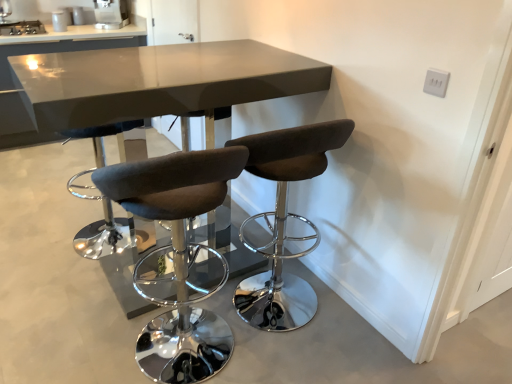
Question: From the image's perspective, is satin silver coffee machine at upper center, which is the 2th appliance in bottom-to-top order, above or below stainless steel stove at upper left, acting as the 2th appliance starting from the top?

Choices:
 (A) below
 (B) above

Answer: (B)

Question: From a real-world perspective, is satin silver coffee machine at upper center, placed as the second appliance when sorted from left to right, physically located above or below stainless steel stove at upper left, the 2th appliance when ordered from right to left?

Choices:
 (A) below
 (B) above

Answer: (B)

Question: Which object is positioned farthest from the stainless steel stove at upper left, the 1th appliance in the bottom-to-top sequence?

Choices:
 (A) brown fabric stool at center, marked as the 1th chair in a right-to-left arrangement
 (B) dark gray fabric stool at center, arranged as the 1th chair when viewed from the left
 (C) satin silver coffee machine at upper center, arranged as the 1th appliance when viewed from the right
 (D) glossy gray table at upper center, which is the 1th table from left to right
 (E) matte gray table at center, the 2th table viewed from the left

Answer: (A)

Question: Considering the real-world distances, which object is closest to the dark gray fabric stool at center, arranged as the 1th chair when viewed from the left?

Choices:
 (A) glossy gray table at upper center, positioned as the second table in front-to-back order
 (B) brown fabric stool at center, the second chair in the left-to-right sequence
 (C) matte gray table at center, which is the first table from front to back
 (D) satin silver coffee machine at upper center, which is the 2th appliance in bottom-to-top order
 (E) stainless steel stove at upper left, acting as the 2th appliance starting from the top

Answer: (B)